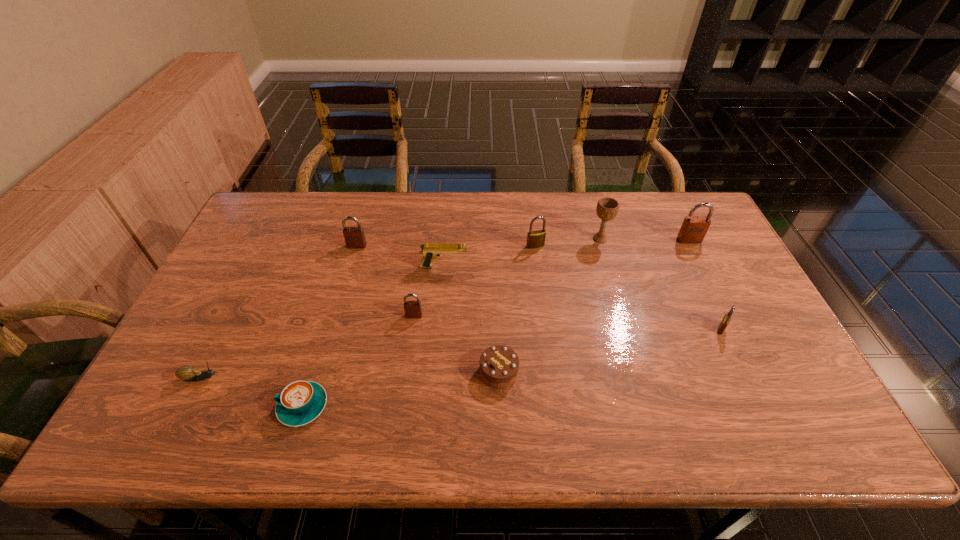
Find the location of a particular element. the rightmost brown padlock is located at coordinates (694, 228).

Find the location of a particular element. The height and width of the screenshot is (540, 960). the tallest padlock is located at coordinates (694, 228).

Find the location of a particular element. chalice is located at coordinates (607, 208).

Identify the location of beige chalice. The image size is (960, 540). (607, 208).

This screenshot has width=960, height=540. In order to click on the left brass padlock in this screenshot , I will do `click(535, 239)`.

Locate an element on the screen. This screenshot has width=960, height=540. the bigger brass padlock is located at coordinates [x=535, y=239].

This screenshot has width=960, height=540. In order to click on the leftmost padlock in this screenshot , I will do `click(354, 237)`.

Find the location of a particular element. The height and width of the screenshot is (540, 960). the leftmost brown padlock is located at coordinates (354, 237).

I want to click on pistol, so click(430, 251).

I want to click on the fifth farthest object, so click(430, 251).